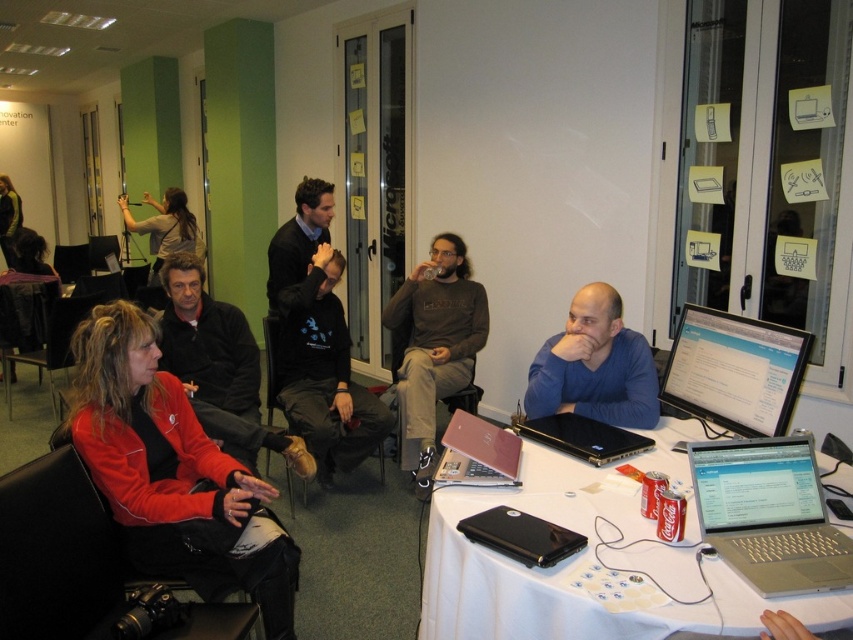
Between silver metallic laptop at lower right and matte black hair at upper left, which one is positioned lower?

Positioned lower is silver metallic laptop at lower right.

Does point (790, 528) lie behind point (195, 237)?

That is False.

Between point (795, 550) and point (173, 216), which one is positioned in front?

Point (795, 550) is more forward.

Find the location of a particular element. This screenshot has height=640, width=853. silver metallic laptop at lower right is located at coordinates (769, 515).

Who is lower down, silver glossy monitor at center right or black matte laptop at lower center?

black matte laptop at lower center is below.

Is point (732, 372) positioned before point (521, 536)?

No, (732, 372) is further to viewer.

Between point (679, 371) and point (511, 508), which one is positioned in front?

Point (511, 508) is in front.

Identify the location of silver glossy monitor at center right. (734, 371).

Is red fleece jacket at center closer to the viewer compared to silver glossy monitor at center right?

No, red fleece jacket at center is behind silver glossy monitor at center right.

Does red fleece jacket at center have a lesser height compared to silver glossy monitor at center right?

No, red fleece jacket at center is not shorter than silver glossy monitor at center right.

Locate an element on the screen. The width and height of the screenshot is (853, 640). red fleece jacket at center is located at coordinates (173, 472).

What are the coordinates of `red fleece jacket at center` in the screenshot? It's located at (173, 472).